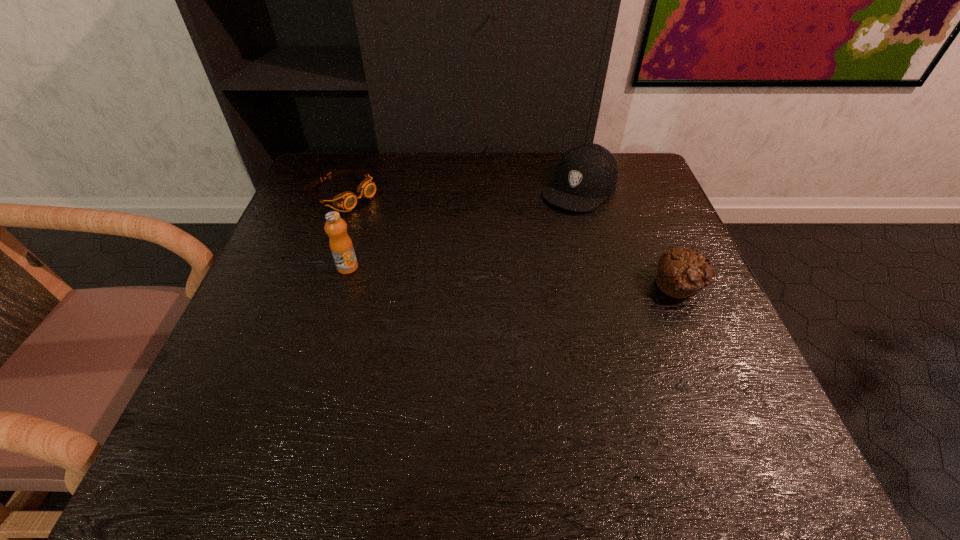
The width and height of the screenshot is (960, 540). I want to click on vacant area that lies between the shortest object and the second tallest object, so click(460, 191).

The image size is (960, 540). I want to click on vacant area between the second tallest object and the third tallest object, so click(630, 237).

Identify the location of vacant space in between the cap and the tallest object. This screenshot has width=960, height=540. (464, 228).

Locate an element on the screen. The width and height of the screenshot is (960, 540). free space that is in between the goggles and the cap is located at coordinates (460, 191).

At what (x,y) coordinates should I click in order to perform the action: click on vacant space that's between the muffin and the goggles. Please return your answer as a coordinate pair (x, y). The height and width of the screenshot is (540, 960). Looking at the image, I should click on (511, 240).

Identify the location of object that stands as the second closest to the cap. The height and width of the screenshot is (540, 960). (347, 200).

Identify which object is located as the nearest to the third shortest object. Please provide its 2D coordinates. Your answer should be formatted as a tuple, i.e. [(x, y)], where the tuple contains the x and y coordinates of a point satisfying the conditions above.

[(681, 271)]

Where is `vacant space that satisfies the following two spatial constraints: 1. on the front label of the tallest object; 2. on the right side of the muffin`? Image resolution: width=960 pixels, height=540 pixels. vacant space that satisfies the following two spatial constraints: 1. on the front label of the tallest object; 2. on the right side of the muffin is located at coordinates (343, 286).

The width and height of the screenshot is (960, 540). I want to click on vacant area that satisfies the following two spatial constraints: 1. on the front label of the tallest object; 2. on the right side of the second shortest object, so click(x=343, y=286).

This screenshot has height=540, width=960. I want to click on free point that satisfies the following two spatial constraints: 1. on the back side of the goggles; 2. on the left side of the cap, so click(x=344, y=188).